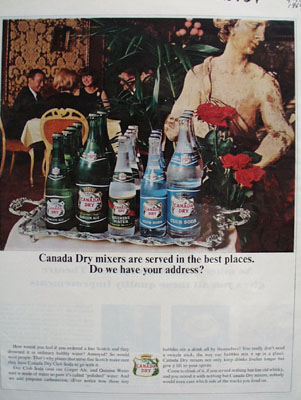
The image size is (301, 400). What are the coordinates of `plate` in the screenshot? It's located at (215, 233).